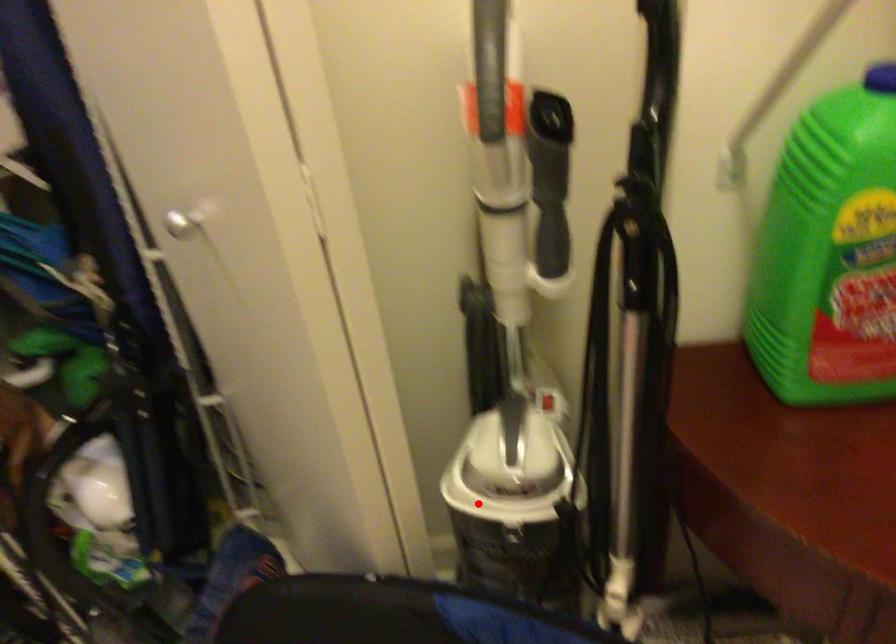
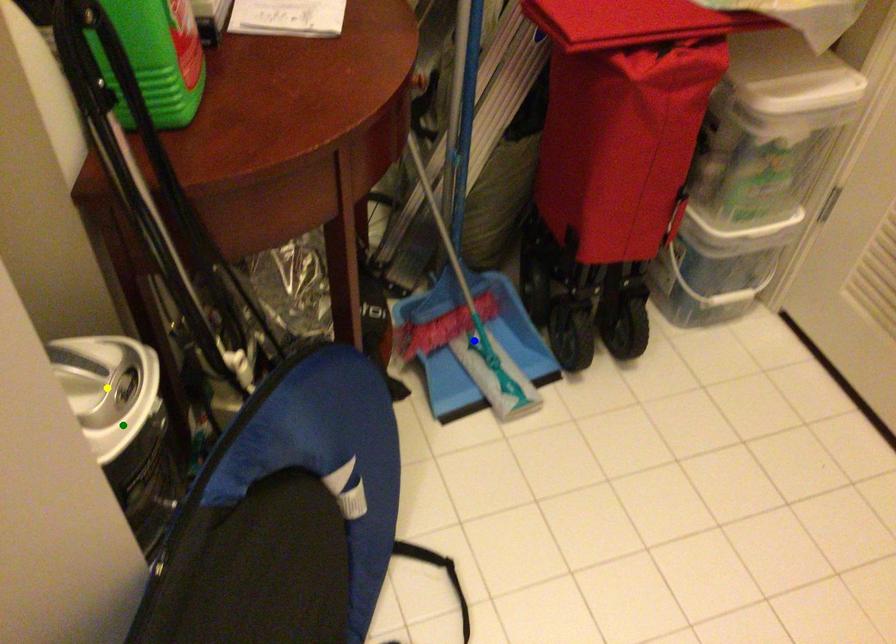
Question: I am providing you with two images of the same scene from different viewpoints. A red point is marked on the first image. You are given multiple points on the second image. Which point in image 2 represents the same 3d spot as the red point in image 1?

Choices:
 (A) yellow point
 (B) blue point
 (C) green point

Answer: (C)